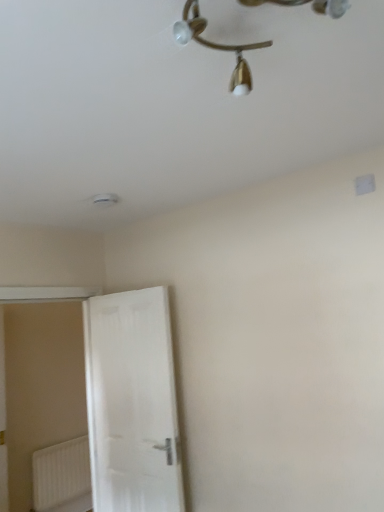
Measure the distance between white plastic radiator at lower left and camera.

white plastic radiator at lower left and camera are 12.22 feet apart from each other.

At what (x,y) coordinates should I click in order to perform the action: click on white plastic radiator at lower left. Please return your answer as a coordinate pair (x, y). The image size is (384, 512). Looking at the image, I should click on (62, 477).

Find the location of a particular element. This screenshot has width=384, height=512. white plastic radiator at lower left is located at coordinates (62, 477).

Which object is further away from the camera, white matte door at left or gold metallic chandelier at upper center?

white matte door at left is behind.

Which of these two, white matte door at left or gold metallic chandelier at upper center, stands taller?

white matte door at left.

From a real-world perspective, who is located lower, white matte door at left or gold metallic chandelier at upper center?

white matte door at left.

Do you think white matte door at left is within gold metallic chandelier at upper center, or outside of it?

white matte door at left is located beyond the bounds of gold metallic chandelier at upper center.

Considering the positions of points (178, 39) and (130, 377), is point (178, 39) closer to camera compared to point (130, 377)?

Yes, it is in front of point (130, 377).

Based on the photo, is gold metallic chandelier at upper center facing towards white matte door at left?

No, gold metallic chandelier at upper center is not oriented towards white matte door at left.

Looking at this image, between gold metallic chandelier at upper center and white matte door at left, which one has larger size?

white matte door at left.

Is gold metallic chandelier at upper center shorter than white matte door at left?

Yes, gold metallic chandelier at upper center is shorter than white matte door at left.

Which object is more forward, gold metallic chandelier at upper center or white plastic radiator at lower left?

gold metallic chandelier at upper center.

Where is `radiator on the left of gold metallic chandelier at upper center`? The image size is (384, 512). radiator on the left of gold metallic chandelier at upper center is located at coordinates (62, 477).

From the image's perspective, which is above, gold metallic chandelier at upper center or white plastic radiator at lower left?

gold metallic chandelier at upper center is shown above in the image.

In the scene shown: Which of these two, white plastic radiator at lower left or gold metallic chandelier at upper center, is bigger?

gold metallic chandelier at upper center.

This screenshot has width=384, height=512. What are the coordinates of `radiator behind the gold metallic chandelier at upper center` in the screenshot? It's located at (62, 477).

Does white plastic radiator at lower left turn towards gold metallic chandelier at upper center?

No, white plastic radiator at lower left is not turned towards gold metallic chandelier at upper center.

Looking at this image, is white plastic radiator at lower left positioned far away from gold metallic chandelier at upper center?

white plastic radiator at lower left is positioned a significant distance from gold metallic chandelier at upper center.

The width and height of the screenshot is (384, 512). I want to click on radiator below the white matte door at left (from the image's perspective), so click(x=62, y=477).

From the picture: From the image's perspective, between white plastic radiator at lower left and white matte door at left, who is located below?

white plastic radiator at lower left, from the image's perspective.

Visually, is white plastic radiator at lower left positioned to the left or to the right of white matte door at left?

Based on their positions, white plastic radiator at lower left is located to the left of white matte door at left.

Is white plastic radiator at lower left at the back of white matte door at left?

No, white plastic radiator at lower left is not at the back of white matte door at left.

Consider the image. Is white matte door at left positioned before white plastic radiator at lower left?

Yes, the depth of white matte door at left is less than that of white plastic radiator at lower left.

Is white matte door at left taller than white plastic radiator at lower left?

Correct, white matte door at left is much taller as white plastic radiator at lower left.

You are a GUI agent. You are given a task and a screenshot of the screen. Output one action in this format:
    pyautogui.click(x=<x>, y=<y>)
    Task: Click on the lamp on the right of white matte door at left
    
    Given the screenshot: What is the action you would take?
    pyautogui.click(x=216, y=46)

Where is `lamp in front of the white matte door at left`? lamp in front of the white matte door at left is located at coordinates (216, 46).

Looking at the image, which one is located further to white matte door at left, white plastic radiator at lower left or gold metallic chandelier at upper center?

Based on the image, gold metallic chandelier at upper center appears to be further to white matte door at left.

Which object lies further to the anchor point white matte door at left, gold metallic chandelier at upper center or white plastic radiator at lower left?

gold metallic chandelier at upper center lies further to white matte door at left than the other object.

In the scene shown: Considering their positions, is gold metallic chandelier at upper center positioned further to white plastic radiator at lower left than white matte door at left?

gold metallic chandelier at upper center is further to white plastic radiator at lower left.

Considering their positions, is white plastic radiator at lower left positioned further to gold metallic chandelier at upper center than white matte door at left?

white plastic radiator at lower left is further to gold metallic chandelier at upper center.

Which object lies further to the anchor point gold metallic chandelier at upper center, white matte door at left or white plastic radiator at lower left?

The object further to gold metallic chandelier at upper center is white plastic radiator at lower left.

From the image, which object appears to be nearer to white plastic radiator at lower left, white matte door at left or gold metallic chandelier at upper center?

white matte door at left is closer to white plastic radiator at lower left.

The height and width of the screenshot is (512, 384). I want to click on door located between gold metallic chandelier at upper center and white plastic radiator at lower left in the depth direction, so click(132, 402).